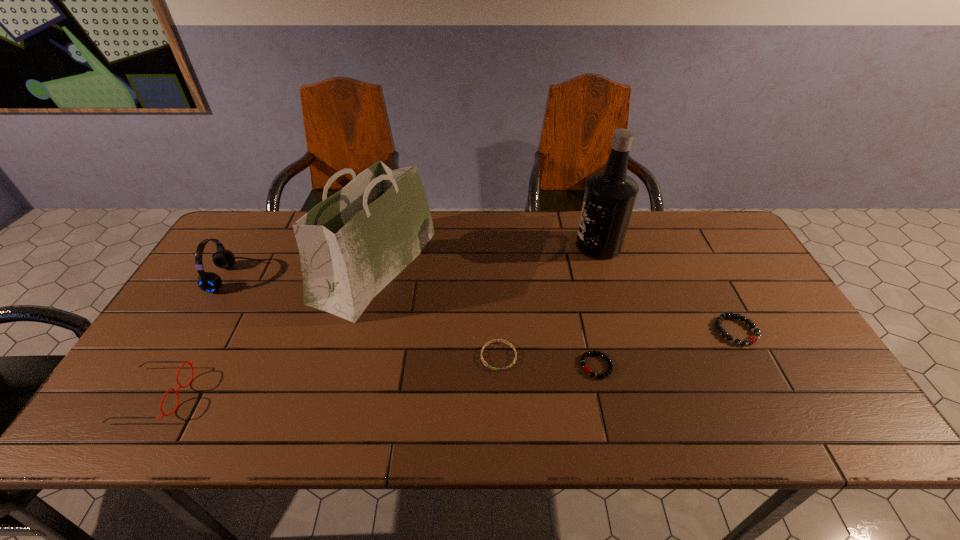
Identify the location of object present at the near edge. (180, 386).

Find the location of `headset situated at the left edge`. headset situated at the left edge is located at coordinates (209, 282).

Find the location of a particular element. spectacles at the left edge is located at coordinates (180, 386).

At what (x,y) coordinates should I click in order to perform the action: click on object that is at the right edge. Please return your answer as a coordinate pair (x, y). The image size is (960, 540). Looking at the image, I should click on (751, 339).

At what (x,y) coordinates should I click in order to perform the action: click on object at the near left corner. Please return your answer as a coordinate pair (x, y). This screenshot has width=960, height=540. Looking at the image, I should click on (180, 386).

This screenshot has height=540, width=960. I want to click on vacant space at the far edge of the desktop, so click(657, 256).

At what (x,y) coordinates should I click in order to perform the action: click on vacant space at the near edge of the desktop. Please return your answer as a coordinate pair (x, y). The width and height of the screenshot is (960, 540). Looking at the image, I should click on (233, 429).

In order to click on vacant space at the right edge of the desktop in this screenshot , I will do `click(780, 320)`.

The height and width of the screenshot is (540, 960). Identify the location of free region at the far left corner. (238, 225).

In the image, there is a desktop. Identify the location of free space at the far right corner. (705, 244).